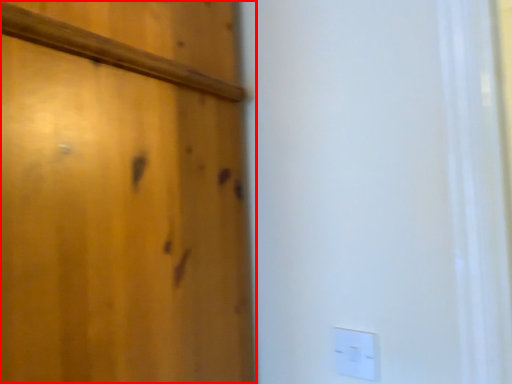
Question: From the image, what is the correct spatial relationship of door (annotated by the red box) in relation to light switch?

Choices:
 (A) left
 (B) right

Answer: (A)